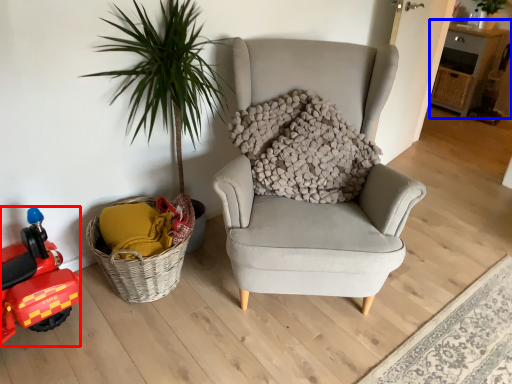
Question: Which object is closer to the camera taking this photo, toy car (highlighted by a red box) or table (highlighted by a blue box)?

Choices:
 (A) toy car
 (B) table

Answer: (A)